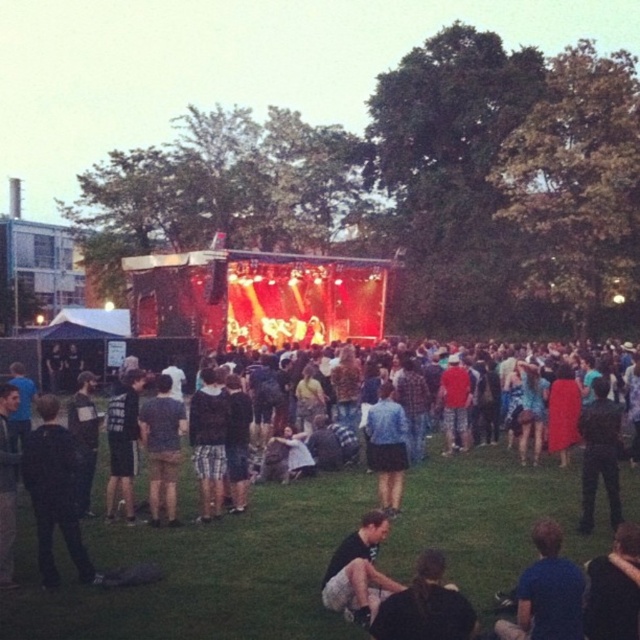
This screenshot has width=640, height=640. Find the location of `black fabric jacket at lower center`. black fabric jacket at lower center is located at coordinates pos(426,605).

From the picture: Is black fabric jacket at lower center below blue denim shorts at center?

Indeed, black fabric jacket at lower center is positioned under blue denim shorts at center.

The width and height of the screenshot is (640, 640). Identify the location of black fabric jacket at lower center. (426, 605).

Where is `black fabric jacket at lower center`? Image resolution: width=640 pixels, height=640 pixels. black fabric jacket at lower center is located at coordinates (426, 605).

Between point (58, 451) and point (394, 451), which one is positioned in front?

Point (58, 451) is in front.

Describe the element at coordinates (54, 492) in the screenshot. Image resolution: width=640 pixels, height=640 pixels. I see `black matte jacket at left` at that location.

Does point (51, 442) lie behind point (392, 486)?

No, (51, 442) is closer to viewer.

Identify the location of black matte jacket at left. Image resolution: width=640 pixels, height=640 pixels. (54, 492).

Which is behind, point (566, 573) or point (442, 584)?

Positioned behind is point (442, 584).

Where is `blue matte shirt at lower right`? Image resolution: width=640 pixels, height=640 pixels. blue matte shirt at lower right is located at coordinates (547, 593).